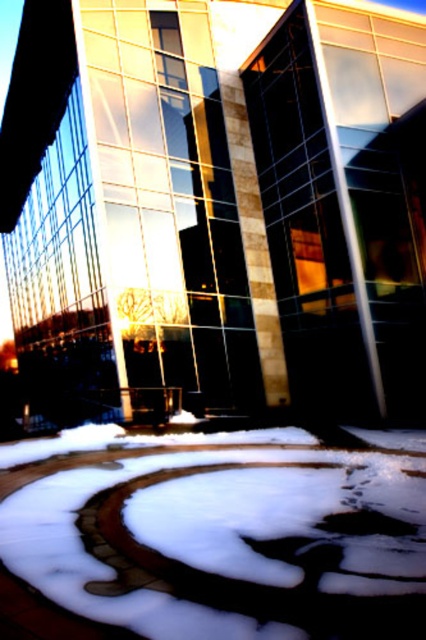
You are standing at the edge of the circular area in the image and want to step onto the white concrete pavement at lower center. Is the brown textured footprint at center in your way?

The white concrete pavement at lower center is below the brown textured footprint at center, so the footprint is blocking the path to the pavement. You would need to step around it to reach the pavement.

You are standing at the edge of a circular area in front of a modern building with large windows. You see a white concrete pavement at lower center and a brown textured footprint at center. Which object is located to the left of the other?

The white concrete pavement at lower center is to the left of the brown textured footprint at center.